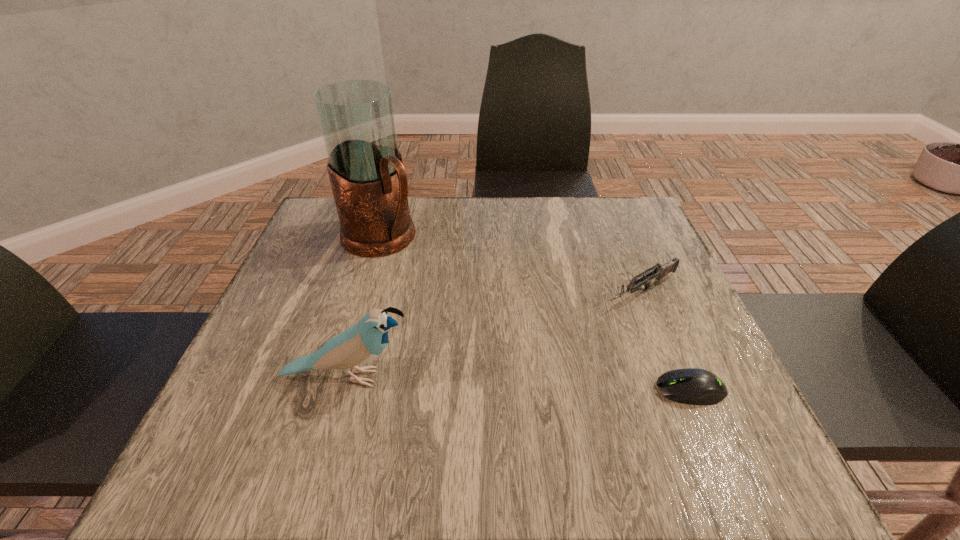
Identify the location of pitcher at the left edge. (369, 182).

The width and height of the screenshot is (960, 540). Identify the location of computer mouse present at the right edge. (692, 386).

The width and height of the screenshot is (960, 540). I want to click on gun present at the right edge, so click(x=659, y=272).

Identify the location of object positioned at the far left corner. (369, 182).

At what (x,y) coordinates should I click in order to perform the action: click on object at the near left corner. Please return your answer as a coordinate pair (x, y). Looking at the image, I should click on (361, 343).

Find the location of a particular element. Image resolution: width=960 pixels, height=540 pixels. object that is at the near right corner is located at coordinates (692, 386).

Find the location of a particular element. The image size is (960, 540). free space at the far edge of the desktop is located at coordinates (549, 219).

In the image, there is a desktop. Identify the location of vacant space at the near edge. (492, 421).

Find the location of a particular element. The width and height of the screenshot is (960, 540). vacant area at the left edge of the desktop is located at coordinates (331, 334).

Image resolution: width=960 pixels, height=540 pixels. In the image, there is a desktop. In order to click on vacant region at the far right corner in this screenshot , I will do `click(600, 223)`.